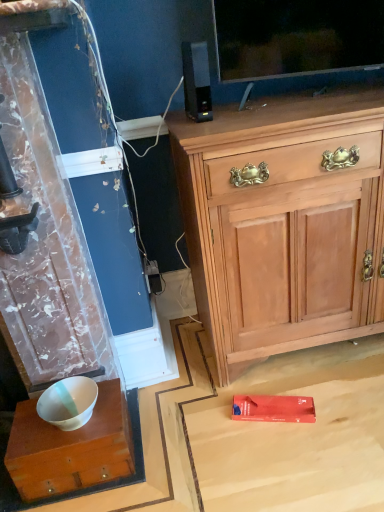
This screenshot has width=384, height=512. Identify the location of free space between light wood cabinet at upper right and white glossy wood desk at lower left. (211, 392).